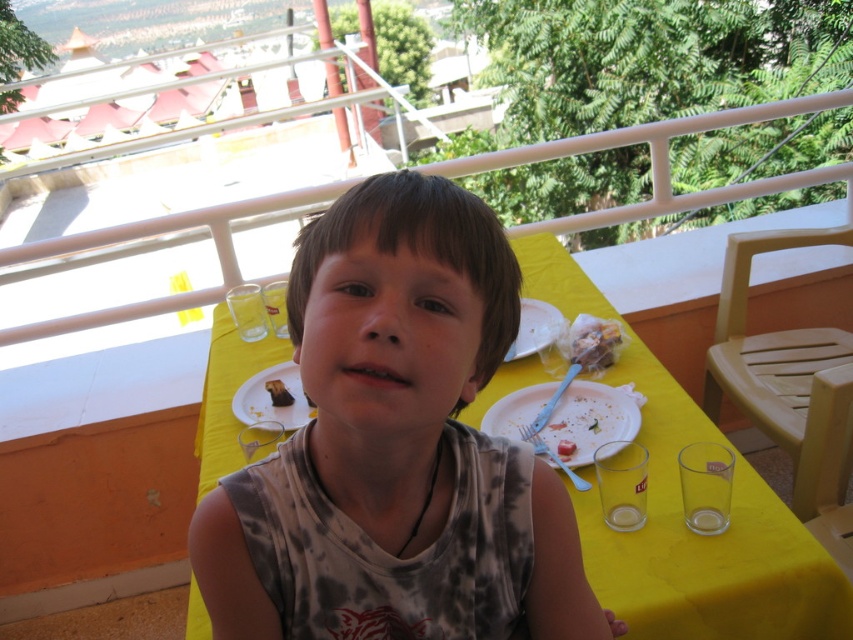
You are the boy in the image. You want to pick up the blue plastic fork at lower center to continue eating the chocolate cake at center. Which direction should you move your hand to reach the fork?

The blue plastic fork at lower center is to the right of the chocolate cake at center, so you should move your hand to the right to reach the fork.

You are a delivery person who needs to place a small package on the table in the image. The table has a white matte plate at center. Where should you place the package so it doesn not cover the plate?

Place the package away from the coordinates point (270,400) where the white matte plate at center is located.

You are a waiter in a restaurant and you see the white plastic plate at center and the white crumbly cake at center on the table. Which item is positioned higher on the table?

The white plastic plate at center is located above the white crumbly cake at center, so it is positioned higher on the table.